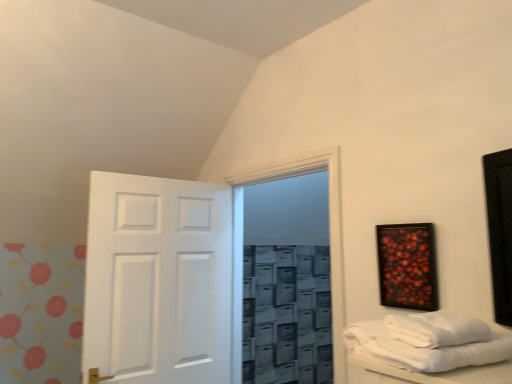
Question: Is white towel at lower right not close to transparent glass door at center?

Choices:
 (A) no
 (B) yes

Answer: (A)

Question: Is white towel at lower right taller than transparent glass door at center?

Choices:
 (A) yes
 (B) no

Answer: (B)

Question: Is white towel at lower right oriented away from transparent glass door at center?

Choices:
 (A) no
 (B) yes

Answer: (A)

Question: From a real-world perspective, is white towel at lower right physically below transparent glass door at center?

Choices:
 (A) no
 (B) yes

Answer: (B)

Question: From a real-world perspective, is white towel at lower right located higher than transparent glass door at center?

Choices:
 (A) yes
 (B) no

Answer: (B)

Question: Does white towel at lower right lie in front of transparent glass door at center?

Choices:
 (A) no
 (B) yes

Answer: (B)

Question: Does wooden-framed artwork at upper right have a larger size compared to white matte door at center?

Choices:
 (A) yes
 (B) no

Answer: (B)

Question: From the image's perspective, is wooden-framed artwork at upper right over white matte door at center?

Choices:
 (A) no
 (B) yes

Answer: (B)

Question: Is wooden-framed artwork at upper right to the right of white matte door at center from the viewer's perspective?

Choices:
 (A) no
 (B) yes

Answer: (B)

Question: Is wooden-framed artwork at upper right thinner than white matte door at center?

Choices:
 (A) yes
 (B) no

Answer: (A)

Question: From a real-world perspective, is wooden-framed artwork at upper right beneath white matte door at center?

Choices:
 (A) no
 (B) yes

Answer: (A)

Question: Does wooden-framed artwork at upper right have a greater height compared to white matte door at center?

Choices:
 (A) no
 (B) yes

Answer: (A)

Question: Would you say white towel at lower right contains wooden-framed artwork at upper right?

Choices:
 (A) yes
 (B) no

Answer: (B)